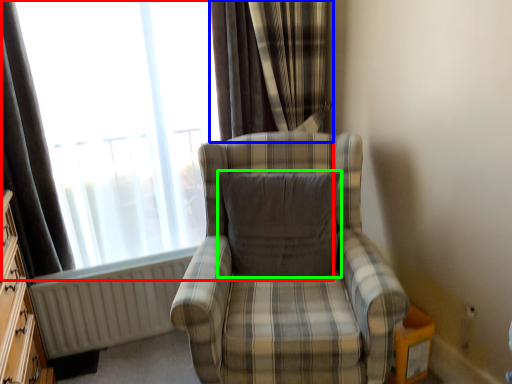
Question: Which object is positioned closest to window (highlighted by a red box)? Select from curtain (highlighted by a blue box) and pillow (highlighted by a green box).

Choices:
 (A) curtain
 (B) pillow

Answer: (A)